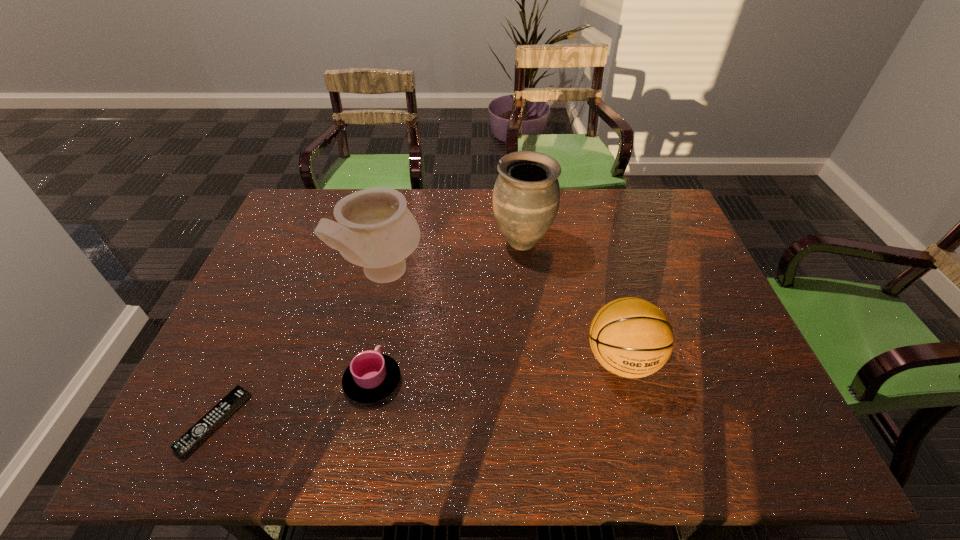
Where is `free point located on the side with the handle of the second shortest object`? free point located on the side with the handle of the second shortest object is located at coordinates (393, 281).

Identify the location of vacant space located on the side with the handle of the second shortest object. (390, 291).

At what (x,y) coordinates should I click in order to perform the action: click on free space located on the back of the remote control. Please return your answer as a coordinate pair (x, y). The height and width of the screenshot is (540, 960). Looking at the image, I should click on (284, 267).

Find the location of a particular element. The width and height of the screenshot is (960, 540). object positioned at the far edge is located at coordinates (526, 195).

In order to click on object that is at the near edge in this screenshot , I will do `click(198, 433)`.

This screenshot has width=960, height=540. I want to click on object at the left edge, so click(198, 433).

I want to click on object located in the near left corner section of the desktop, so [x=198, y=433].

In the image, there is a desktop. Where is `free space at the far edge`? This screenshot has width=960, height=540. free space at the far edge is located at coordinates (608, 191).

You are a GUI agent. You are given a task and a screenshot of the screen. Output one action in this format:
    pyautogui.click(x=<x>, y=<y>)
    Task: Click on the free region at the near edge of the desktop
    This screenshot has height=540, width=960.
    Given the screenshot: What is the action you would take?
    pyautogui.click(x=556, y=437)

Find the location of a particular element. Image resolution: width=960 pixels, height=540 pixels. free region at the right edge is located at coordinates (715, 350).